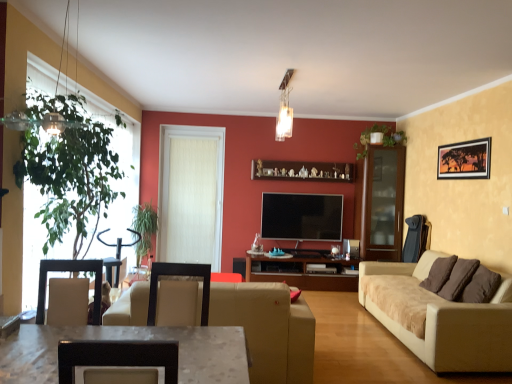
This screenshot has width=512, height=384. What are the coordinates of `green leafy plant at left` in the screenshot? It's located at (74, 175).

Find the location of `transparent glass cabinet at right`. transparent glass cabinet at right is located at coordinates (382, 204).

Can silk matte picture frame at upper right be found inside green leafy plant at upper center, positioned as the first plant in right-to-left order?

Actually, silk matte picture frame at upper right is outside green leafy plant at upper center, positioned as the first plant in right-to-left order.

Is green leafy plant at upper center, arranged as the 1th plant when viewed from the top, bigger than silk matte picture frame at upper right?

Yes, green leafy plant at upper center, arranged as the 1th plant when viewed from the top, is bigger than silk matte picture frame at upper right.

From a real-world perspective, is green leafy plant at upper center, positioned as the first plant in right-to-left order, positioned over silk matte picture frame at upper right based on gravity?

Yes, from a real-world perspective, green leafy plant at upper center, positioned as the first plant in right-to-left order, is above silk matte picture frame at upper right.

From the image's perspective, does green leafy plant at upper center, arranged as the 1th plant when viewed from the top, appear higher than silk matte picture frame at upper right?

Yes, from the image's perspective, green leafy plant at upper center, arranged as the 1th plant when viewed from the top, is on top of silk matte picture frame at upper right.

The image size is (512, 384). I want to click on window screen above the flat screen tv at center (from a real-world perspective), so click(191, 194).

Is white textured door at center a part of flat screen tv at center?

That's incorrect, white textured door at center is not inside flat screen tv at center.

Is flat screen tv at center looking in the opposite direction of white textured door at center?

That's not correct — flat screen tv at center is not looking away from white textured door at center.

Is metallic glass light fixture at upper center oriented towards green leafy plant at left?

No, metallic glass light fixture at upper center is not aimed at green leafy plant at left.

Can you confirm if metallic glass light fixture at upper center is shorter than green leafy plant at left?

Yes, metallic glass light fixture at upper center is shorter than green leafy plant at left.

Between metallic glass light fixture at upper center and green leafy plant at left, which one is positioned behind?

metallic glass light fixture at upper center is further away from the camera.

Does point (283, 86) come behind point (100, 174)?

Yes, it is behind point (100, 174).

Image resolution: width=512 pixels, height=384 pixels. In order to click on light fixture in front of the flat screen tv at center in this screenshot , I will do `click(285, 109)`.

Would you say flat screen tv at center is a long distance from metallic glass light fixture at upper center?

That's right, there is a large distance between flat screen tv at center and metallic glass light fixture at upper center.

From a real-world perspective, is flat screen tv at center under metallic glass light fixture at upper center?

Correct, in the physical world, flat screen tv at center is lower than metallic glass light fixture at upper center.

Who is taller, flat screen tv at center or metallic glass light fixture at upper center?

Standing taller between the two is flat screen tv at center.

Is white marble table at lower left closer to the viewer compared to green leafy plant at left?

Yes, the depth of white marble table at lower left is less than that of green leafy plant at left.

From the image's perspective, is white marble table at lower left located above green leafy plant at left?

Incorrect, from the image's perspective, white marble table at lower left is lower than green leafy plant at left.

Between point (241, 340) and point (32, 296), which one is positioned behind?

The point (32, 296) is more distant.

Looking at the image, does white marble table at lower left seem bigger or smaller compared to green leafy plant at left?

In the image, white marble table at lower left appears to be smaller than green leafy plant at left.

In the image, is silk matte picture frame at upper right on the left side or the right side of green leafy plant at center, which appears as the second plant when viewed from the top?

silk matte picture frame at upper right is to the right of green leafy plant at center, which appears as the second plant when viewed from the top.

From the image's perspective, is silk matte picture frame at upper right under green leafy plant at center, arranged as the first plant when ordered from the bottom?

No, from the image's perspective, silk matte picture frame at upper right is not beneath green leafy plant at center, arranged as the first plant when ordered from the bottom.

From their relative heights in the image, would you say silk matte picture frame at upper right is taller or shorter than green leafy plant at center, the 1th plant positioned from the left?

silk matte picture frame at upper right is shorter than green leafy plant at center, the 1th plant positioned from the left.

Is silk matte picture frame at upper right touching green leafy plant at center, the 1th plant positioned from the left?

No, silk matte picture frame at upper right is not beside green leafy plant at center, the 1th plant positioned from the left.

Is green leafy plant at center, which appears as the second plant when viewed from the right, shorter than flat screen tv at center?

No, green leafy plant at center, which appears as the second plant when viewed from the right, is not shorter than flat screen tv at center.

Locate an element on the screen. This screenshot has width=512, height=384. television that is above the green leafy plant at center, the 1th plant positioned from the left (from a real-world perspective) is located at coordinates (302, 217).

Is green leafy plant at center, arranged as the first plant when ordered from the bottom, smaller than flat screen tv at center?

Actually, green leafy plant at center, arranged as the first plant when ordered from the bottom, might be larger than flat screen tv at center.

Could flat screen tv at center be considered to be inside green leafy plant at center, the 1th plant positioned from the left?

No, flat screen tv at center is not inside green leafy plant at center, the 1th plant positioned from the left.

Image resolution: width=512 pixels, height=384 pixels. Identify the location of picture frame below the green leafy plant at upper center, positioned as the second plant in bottom-to-top order (from the image's perspective). (465, 160).

I want to click on television on the right of white textured door at center, so click(x=302, y=217).

Estimate the real-world distances between objects in this image. Which object is closer to flat screen tv at center, silk matte picture frame at upper right or wooden entertainment center at center?

Based on the image, wooden entertainment center at center appears to be nearer to flat screen tv at center.

Based on their spatial positions, is green leafy plant at center, which appears as the second plant when viewed from the right, or flat screen tv at center further from green leafy plant at upper center, positioned as the first plant in right-to-left order?

Based on the image, green leafy plant at center, which appears as the second plant when viewed from the right, appears to be further to green leafy plant at upper center, positioned as the first plant in right-to-left order.

Looking at the image, which one is located closer to white textured door at center, metallic glass light fixture at upper center or beige leather couch at center, the second studio couch positioned from the right?

metallic glass light fixture at upper center.

Considering their positions, is white textured door at center positioned closer to silk matte picture frame at upper right than metallic glass light fixture at upper center?

metallic glass light fixture at upper center.

Consider the image. Which object lies nearer to the anchor point green leafy plant at upper center, arranged as the 1th plant when viewed from the top, metallic glass light fixture at upper center or green leafy plant at left?

The object closer to green leafy plant at upper center, arranged as the 1th plant when viewed from the top, is metallic glass light fixture at upper center.

Considering their positions, is beige leather couch at center, marked as the first studio couch in a left-to-right arrangement, positioned further to silk matte picture frame at upper right than beige suede sofa at right, placed as the first studio couch when sorted from right to left?

The object further to silk matte picture frame at upper right is beige leather couch at center, marked as the first studio couch in a left-to-right arrangement.

Based on their spatial positions, is flat screen tv at center or green leafy plant at upper center, arranged as the 1th plant when viewed from the top, further from metallic glass light fixture at upper center?

The object further to metallic glass light fixture at upper center is green leafy plant at upper center, arranged as the 1th plant when viewed from the top.

When comparing their distances from white marble table at lower left, does green leafy plant at center, the 1th plant positioned from the left, or white textured door at center seem closer?

The object closer to white marble table at lower left is green leafy plant at center, the 1th plant positioned from the left.

Locate an element on the screen. The image size is (512, 384). window between white marble table at lower left and green leafy plant at upper center, arranged as the 1th plant when viewed from the top, in the front-back direction is located at coordinates (74, 175).

This screenshot has width=512, height=384. What are the coordinates of `plant between green leafy plant at center, the 1th plant positioned from the left, and beige suede sofa at right, placed as the first studio couch when sorted from right to left` in the screenshot? It's located at (383, 139).

Where is `picture frame positioned between white marble table at lower left and white textured door at center from near to far`? The height and width of the screenshot is (384, 512). picture frame positioned between white marble table at lower left and white textured door at center from near to far is located at coordinates (465, 160).

The height and width of the screenshot is (384, 512). What are the coordinates of `television between wooden entertainment center at center and transparent glass cabinet at right in the horizontal direction` in the screenshot? It's located at pyautogui.click(x=302, y=217).